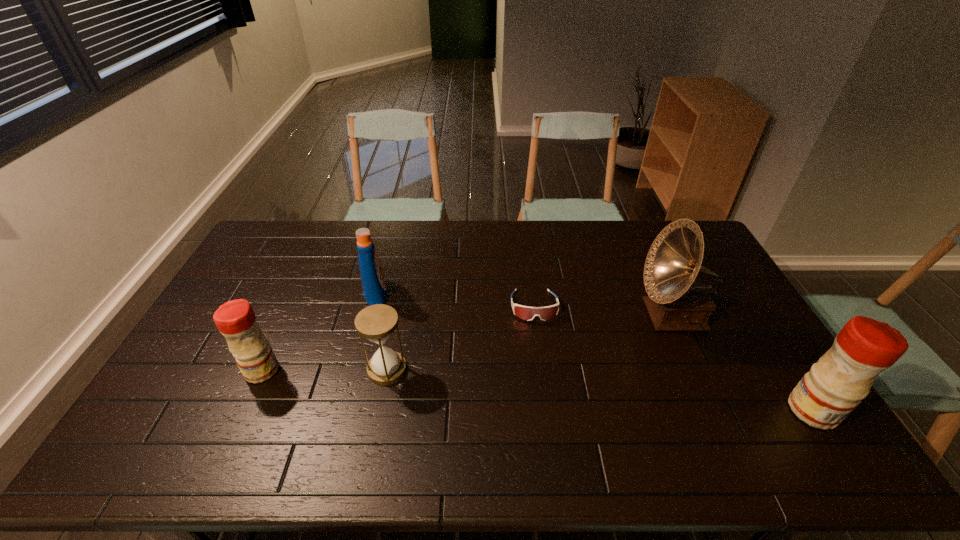
Locate an element on the screen. the farther condiment is located at coordinates (236, 321).

At what (x,y) coordinates should I click in order to perform the action: click on the left condiment. Please return your answer as a coordinate pair (x, y). The height and width of the screenshot is (540, 960). Looking at the image, I should click on (236, 321).

Where is `the taller condiment`? Image resolution: width=960 pixels, height=540 pixels. the taller condiment is located at coordinates tap(835, 385).

Find the location of `the rightmost object`. the rightmost object is located at coordinates (835, 385).

Locate an element on the screen. This screenshot has height=540, width=960. detergent is located at coordinates (372, 278).

Find the location of `the fifth object from left to right`. the fifth object from left to right is located at coordinates (678, 301).

Where is `the shortest object`? The width and height of the screenshot is (960, 540). the shortest object is located at coordinates (527, 313).

Identify the location of goggles. point(527,313).

Image resolution: width=960 pixels, height=540 pixels. I want to click on hourglass, so click(376, 323).

Image resolution: width=960 pixels, height=540 pixels. What are the coordinates of `free space located 0.060m on the back of the shorter condiment` in the screenshot? It's located at (276, 341).